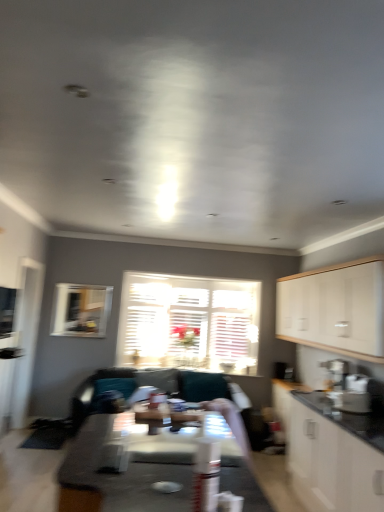
Question: In terms of size, does white wooden blinds at center, which appears as the second window when viewed from the left, appear bigger or smaller than smooth white table at center, which is counted as the second table, starting from the top?

Choices:
 (A) small
 (B) big

Answer: (A)

Question: Is white wooden blinds at center, the first window from the right, in front of or behind smooth white table at center, which is the 1th table from bottom to top, in the image?

Choices:
 (A) behind
 (B) front

Answer: (A)

Question: Estimate the real-world distances between objects in this image. Which object is farther from the teal fabric couch at center?

Choices:
 (A) wooden glossy table at center, acting as the 2th table starting from the bottom
 (B) white wooden blinds at center, the first window from the right
 (C) white matte cabinet at lower right, which is the 1th cabinetry in bottom-to-top order
 (D) clear glass window at upper left, acting as the first window starting from the front
 (E) clear glass window screen at left

Answer: (C)

Question: Estimate the real-world distances between objects in this image. Which object is farther from the white matte cabinet at lower right, which is the 1th cabinetry in bottom-to-top order?

Choices:
 (A) white matte cabinet at right, which is the first cabinetry from top to bottom
 (B) transparent glass door at left
 (C) smooth white table at center, which is counted as the second table, starting from the top
 (D) clear glass window at upper left, acting as the first window starting from the front
 (E) satin silver coffee maker at right

Answer: (B)